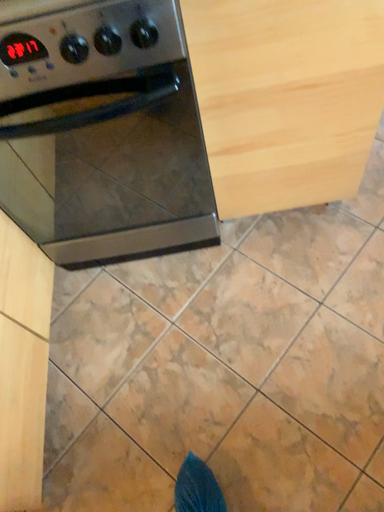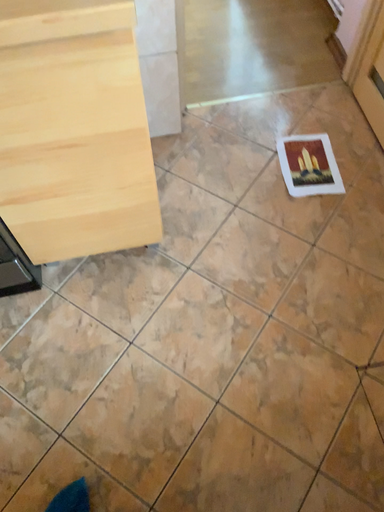
Question: Which way did the camera rotate in the video?

Choices:
 (A) rotated right
 (B) rotated left

Answer: (A)